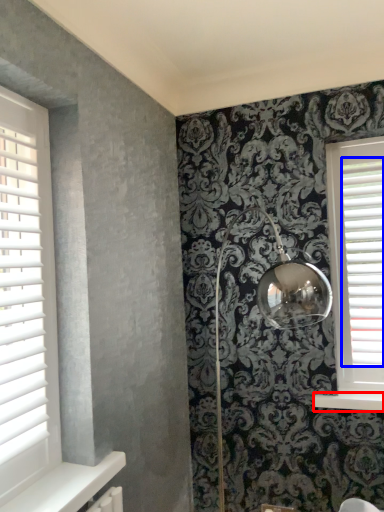
Question: Which object appears closest to the camera in this image, window sill (highlighted by a red box) or blind (highlighted by a blue box)?

Choices:
 (A) window sill
 (B) blind

Answer: (A)